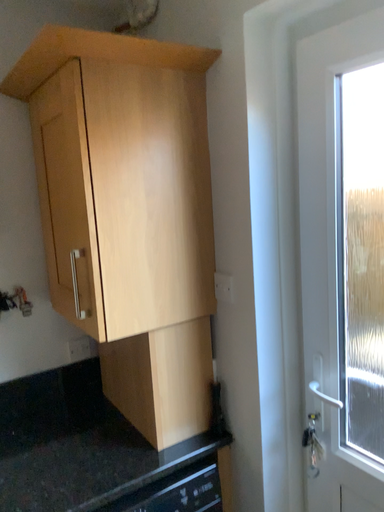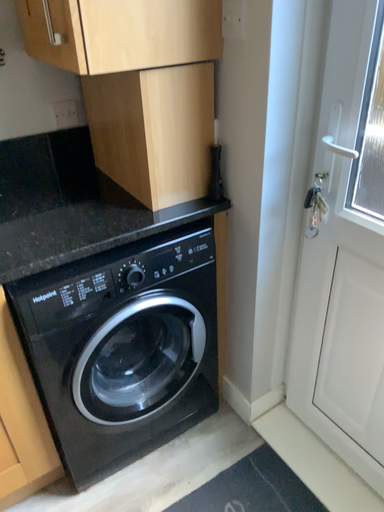
Question: How did the camera likely rotate when shooting the video?

Choices:
 (A) rotated downward
 (B) rotated upward

Answer: (A)